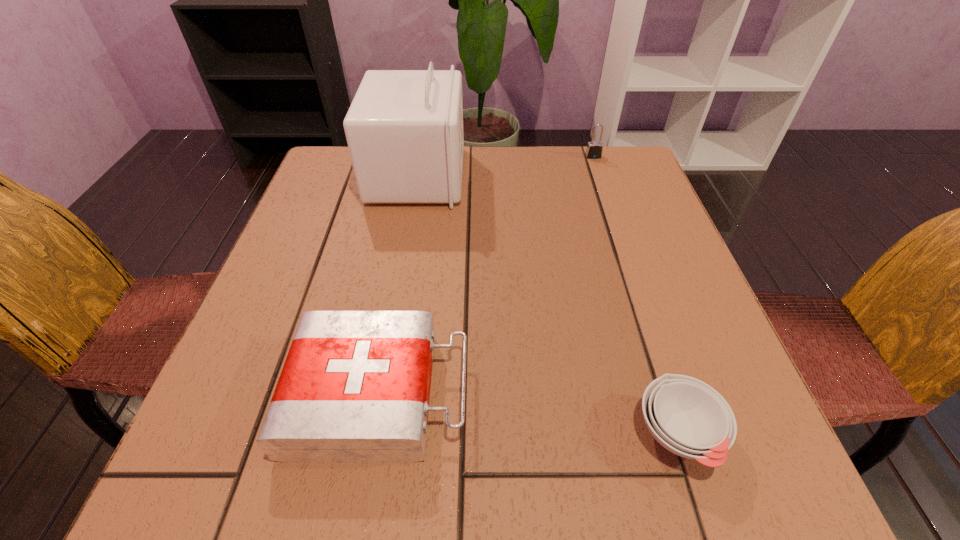
The width and height of the screenshot is (960, 540). I want to click on free spot between the padlock and the tallest object, so click(505, 166).

Locate an element on the screen. The width and height of the screenshot is (960, 540). vacant space that's between the nearer first-aid kit and the padlock is located at coordinates (486, 275).

Image resolution: width=960 pixels, height=540 pixels. What are the coordinates of `free space between the farther first-aid kit and the shortest object` in the screenshot? It's located at (547, 305).

Locate an element on the screen. The width and height of the screenshot is (960, 540). free point between the second tallest object and the tallest object is located at coordinates [x=505, y=166].

At what (x,y) coordinates should I click in order to perform the action: click on free spot between the second tallest object and the tallest object. Please return your answer as a coordinate pair (x, y). The image size is (960, 540). Looking at the image, I should click on (505, 166).

You are a GUI agent. You are given a task and a screenshot of the screen. Output one action in this format:
    pyautogui.click(x=<x>, y=<y>)
    Task: Click on the unoccupied position between the farther first-aid kit and the shorter first-aid kit
    The width and height of the screenshot is (960, 540).
    Given the screenshot: What is the action you would take?
    pyautogui.click(x=398, y=285)

The height and width of the screenshot is (540, 960). What are the coordinates of `empty location between the taller first-aid kit and the soup bowl` in the screenshot? It's located at (547, 305).

The width and height of the screenshot is (960, 540). I want to click on the closest object to the shorter first-aid kit, so click(x=689, y=418).

Point out which object is positioned as the nearest to the third shortest object. Please provide its 2D coordinates. Your answer should be formatted as a tuple, i.e. [(x, y)], where the tuple contains the x and y coordinates of a point satisfying the conditions above.

[(404, 129)]

I want to click on free region that satisfies the following two spatial constraints: 1. on the shackle of the third shortest object; 2. on the front side of the nearer first-aid kit, so click(x=673, y=394).